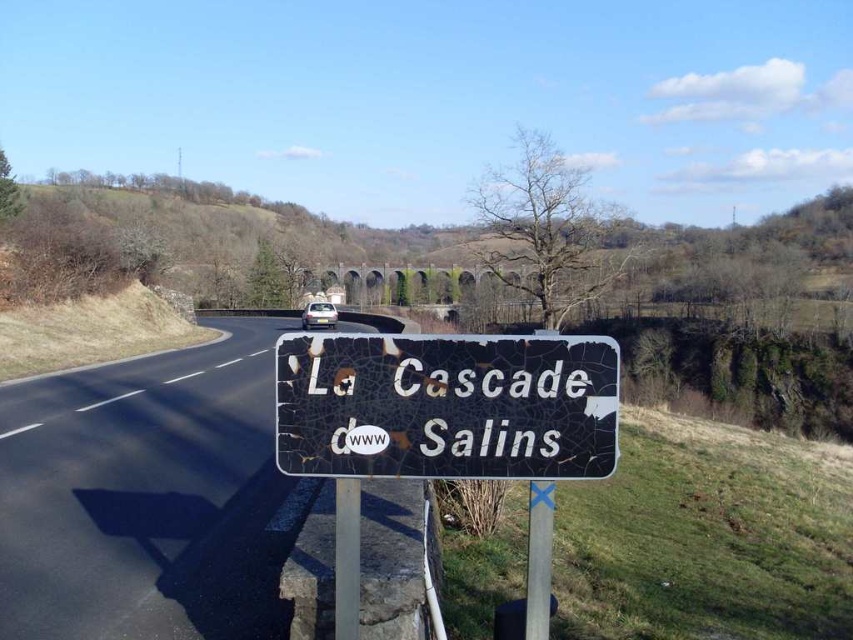
Can you confirm if cracked paint sign at center is shorter than cracked metal sign at lower center?

No.

Which is more to the left, cracked paint sign at center or cracked metal sign at lower center?

cracked metal sign at lower center

Is point (454, 461) in front of point (328, 396)?

No, it is behind (328, 396).

The image size is (853, 640). In order to click on cracked paint sign at center in this screenshot , I will do `click(445, 426)`.

Does black asphalt road at center come in front of cracked metal sign at lower center?

No, black asphalt road at center is further to the viewer.

Which is above, black asphalt road at center or cracked metal sign at lower center?

cracked metal sign at lower center

The height and width of the screenshot is (640, 853). Find the location of `black asphalt road at center`. black asphalt road at center is located at coordinates (148, 497).

The height and width of the screenshot is (640, 853). I want to click on black asphalt road at center, so click(148, 497).

Based on the photo, who is shorter, black asphalt road at center or cracked paint sign at center?

Standing shorter between the two is black asphalt road at center.

Who is more forward, (97, 476) or (334, 577)?

Point (334, 577) is more forward.

Where is `black asphalt road at center`? Image resolution: width=853 pixels, height=640 pixels. black asphalt road at center is located at coordinates (148, 497).